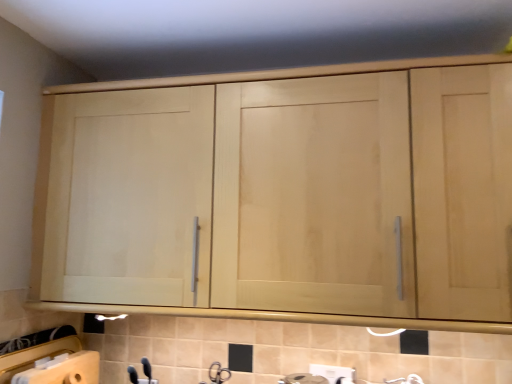
Question: Is light wood cabinet at upper center bigger or smaller than matte silver faucet at lower center?

Choices:
 (A) big
 (B) small

Answer: (A)

Question: Do you think light wood cabinet at upper center is within matte silver faucet at lower center, or outside of it?

Choices:
 (A) outside
 (B) inside

Answer: (A)

Question: In terms of width, does light wood cabinet at upper center look wider or thinner when compared to matte silver faucet at lower center?

Choices:
 (A) wide
 (B) thin

Answer: (A)

Question: Is matte silver faucet at lower center inside or outside of light wood cabinet at upper center?

Choices:
 (A) inside
 (B) outside

Answer: (B)

Question: Does point (214, 382) appear closer or farther from the camera than point (65, 125)?

Choices:
 (A) closer
 (B) farther

Answer: (B)

Question: From a real-world perspective, is matte silver faucet at lower center positioned above or below light wood cabinet at upper center?

Choices:
 (A) below
 (B) above

Answer: (A)

Question: From the image's perspective, is matte silver faucet at lower center above or below light wood cabinet at upper center?

Choices:
 (A) below
 (B) above

Answer: (A)